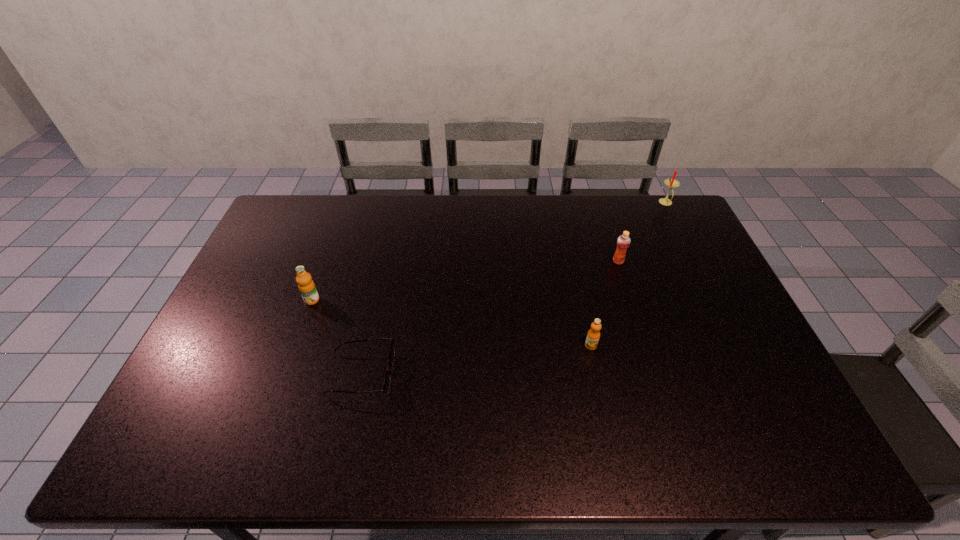
Locate an element on the screen. The image size is (960, 540). free space located on the left of the rightmost object is located at coordinates (636, 203).

The image size is (960, 540). Find the location of `free spot located 0.380m on the label of the third nearest object`. free spot located 0.380m on the label of the third nearest object is located at coordinates (267, 426).

Locate an element on the screen. The width and height of the screenshot is (960, 540). vacant region located 0.310m on the left of the farthest orange juice is located at coordinates (518, 261).

Identify the location of vacant space located on the front label of the nearest orange juice. The image size is (960, 540). click(595, 366).

At what (x,y) coordinates should I click in order to perform the action: click on free space located on the face of the spectacles. Please return your answer as a coordinate pair (x, y). Looking at the image, I should click on (465, 374).

The image size is (960, 540). Identify the location of object that is at the far edge. (671, 183).

Find the location of a particular element. Image resolution: width=960 pixels, height=540 pixels. object that is at the right edge is located at coordinates (671, 183).

Where is `object that is positioned at the far right corner`? The width and height of the screenshot is (960, 540). object that is positioned at the far right corner is located at coordinates (671, 183).

Image resolution: width=960 pixels, height=540 pixels. In order to click on free space at the far edge of the desktop in this screenshot , I will do `click(480, 227)`.

In the image, there is a desktop. Identify the location of vacant space at the near edge. (314, 457).